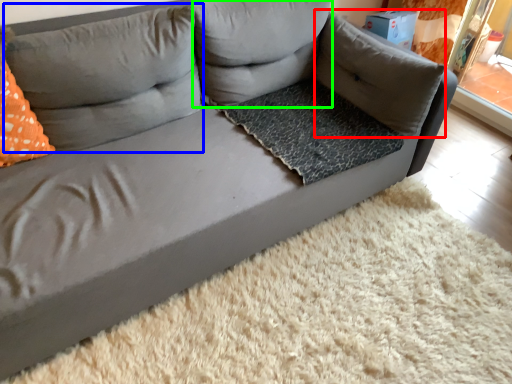
Question: Which is farther away from pillow (highlighted by a red box)? pillow (highlighted by a blue box) or pillow (highlighted by a green box)?

Choices:
 (A) pillow
 (B) pillow

Answer: (A)